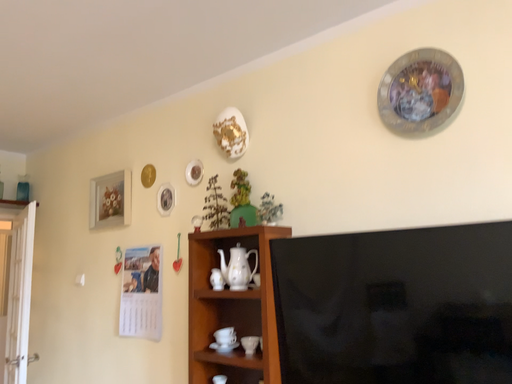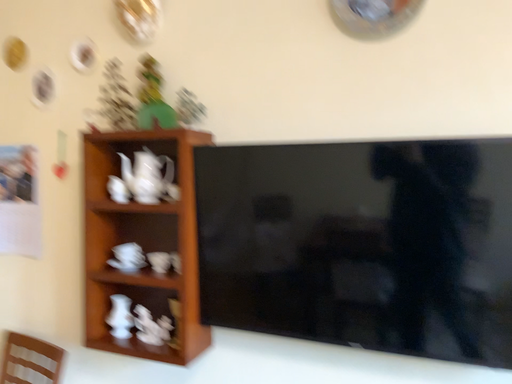
Question: Which way did the camera rotate in the video?

Choices:
 (A) rotated upward
 (B) rotated downward

Answer: (B)